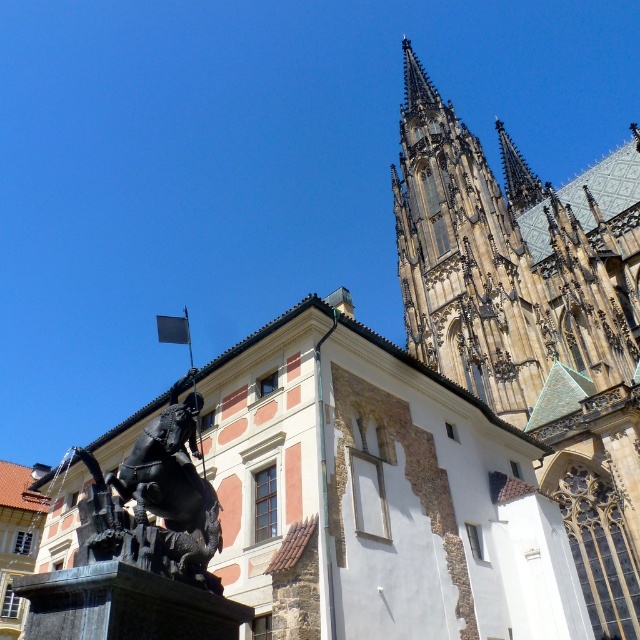
Is golden stone spire at upper center above polished bronze statue at center?

Indeed, golden stone spire at upper center is positioned over polished bronze statue at center.

Who is taller, golden stone spire at upper center or polished bronze statue at center?

With more height is golden stone spire at upper center.

Locate an element on the screen. golden stone spire at upper center is located at coordinates (464, 259).

Identify the location of golden stone spire at upper center. Image resolution: width=640 pixels, height=640 pixels. (464, 259).

Is point (442, 148) positioned behind point (449, 221)?

Yes.

Between golden stone tower at upper center and golden stone spire at upper center, which one is positioned higher?

golden stone spire at upper center

Which is in front, point (529, 328) or point (516, 356)?

Point (516, 356)

At what (x,y) coordinates should I click in order to perform the action: click on golden stone tower at upper center. Please return your answer as a coordinate pair (x, y). The image size is (640, 640). Looking at the image, I should click on (532, 317).

Between golden stone tower at upper center and polished bronze statue at center, which one has less height?

polished bronze statue at center

Measure the distance between golden stone tower at upper center and polished bronze statue at center.

The distance of golden stone tower at upper center from polished bronze statue at center is 235.42 feet.

You are a GUI agent. You are given a task and a screenshot of the screen. Output one action in this format:
    pyautogui.click(x=<x>, y=<y>)
    Task: Click on the golden stone tower at upper center
    The image size is (640, 640).
    Given the screenshot: What is the action you would take?
    pyautogui.click(x=532, y=317)

At what (x,y) coordinates should I click in order to perform the action: click on golden stone tower at upper center. Please return your answer as a coordinate pair (x, y). Image resolution: width=640 pixels, height=640 pixels. Looking at the image, I should click on (532, 317).